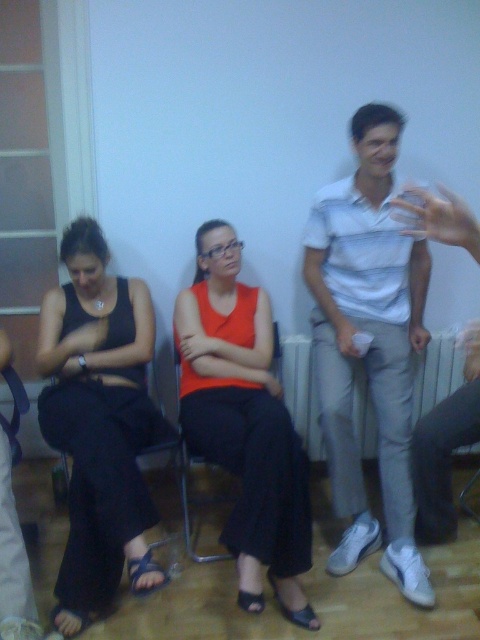
Question: Is black fabric dress at left thinner than white cotton shirt at center?

Choices:
 (A) no
 (B) yes

Answer: (A)

Question: Among these points, which one is nearest to the camera?

Choices:
 (A) (277, 378)
 (B) (316, 244)

Answer: (B)

Question: Does black fabric dress at left lie behind matte orange tank top at center?

Choices:
 (A) yes
 (B) no

Answer: (B)

Question: Can you confirm if matte orange tank top at center is positioned to the left of metallic silver chair at center?

Choices:
 (A) no
 (B) yes

Answer: (A)

Question: Which object is the closest to the white cotton shirt at center?

Choices:
 (A) black fabric dress at left
 (B) metallic silver chair at center
 (C) matte orange tank top at center
 (D) white striped shirt at center

Answer: (D)

Question: Which object is the farthest from the matte orange tank top at center?

Choices:
 (A) white plastic radiator at center
 (B) white cotton shirt at center
 (C) black fabric dress at left

Answer: (B)